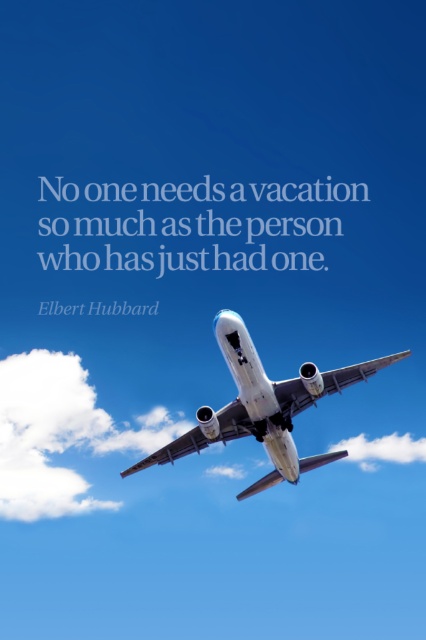
Question: Does white glossy airplane at center appear on the left side of white fluffy cloud at center?

Choices:
 (A) no
 (B) yes

Answer: (B)

Question: Which object appears closest to the camera in this image?

Choices:
 (A) white glossy airplane at center
 (B) white fluffy cloud at lower left

Answer: (A)

Question: Is white glossy airplane at center smaller than white fluffy cloud at center?

Choices:
 (A) no
 (B) yes

Answer: (B)

Question: Among these points, which one is nearest to the camera?

Choices:
 (A) (23, 384)
 (B) (400, 452)
 (C) (216, 438)

Answer: (C)

Question: Is white glossy airplane at center to the left of white fluffy cloud at center from the viewer's perspective?

Choices:
 (A) yes
 (B) no

Answer: (A)

Question: Which of the following is the closest to the observer?

Choices:
 (A) (5, 516)
 (B) (420, 451)

Answer: (B)